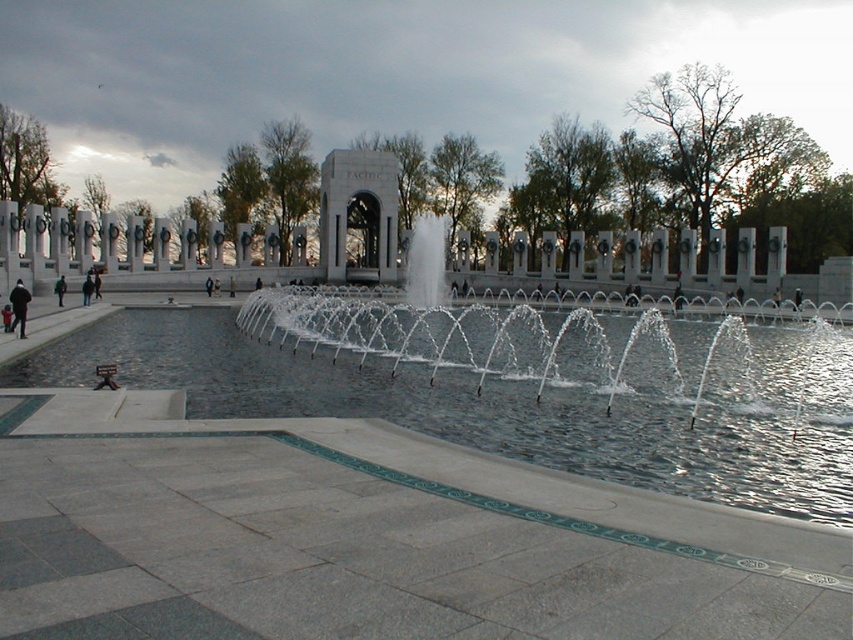
You are a photographer planning to capture the fountain and the jacket in the scene. Since you want to highlight both the clear water at center and the dark gray jacket at left, which object should you focus on first to ensure proper exposure, considering their sizes?

The clear water at center is larger in size than the dark gray jacket at left, so you should focus on the clear water at center first to ensure proper exposure for the larger area.

You are standing at the edge of the plaza and want to take a photo of the clear glass pool at center and the clear water at center. Which object will appear larger in your photo?

The clear glass pool at center will appear larger in the photo because it is closer to the viewer than the clear water at center.

You are designing a water feature for a new plaza and want to ensure safety for visitors. The clear glass pool at center and the clear water at center are both present. Which one should you place a caution sign near, considering their heights?

The clear glass pool at center is not as tall as clear water at center, so the caution sign should be placed near the clear water at center since it is taller and may pose a higher risk of slipping or falling.